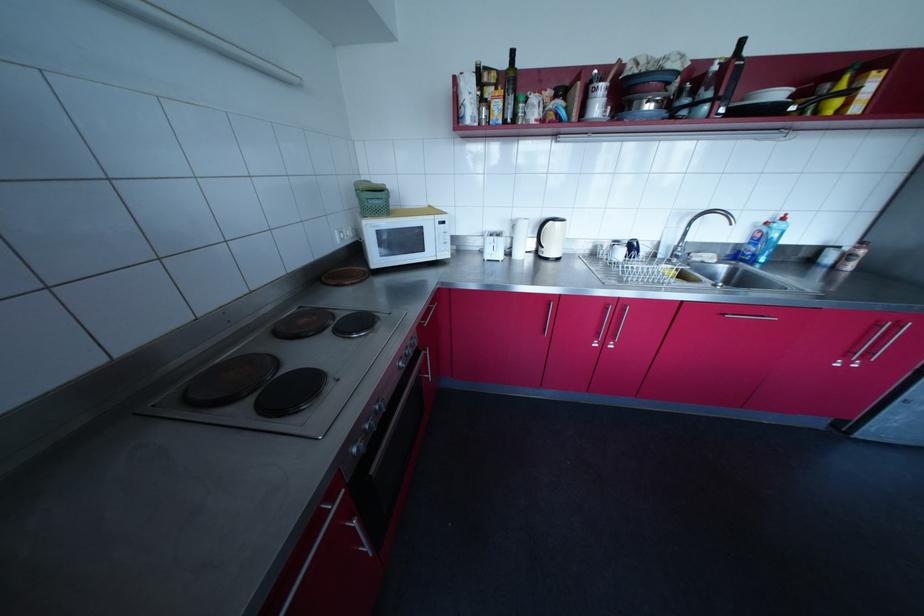
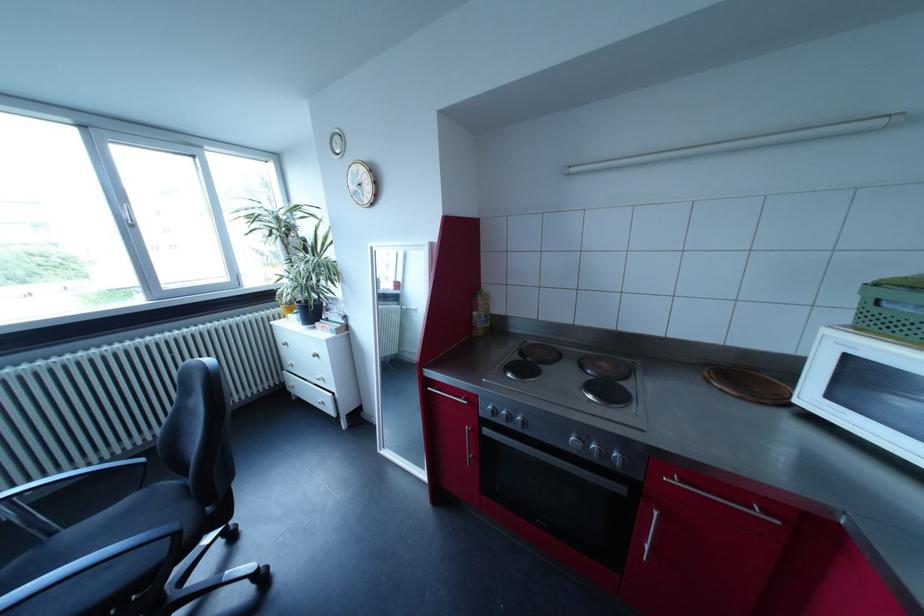
The first image is from the beginning of the video and the second image is from the end. How did the camera likely rotate when shooting the video?

The rotation direction of the camera is left-down.